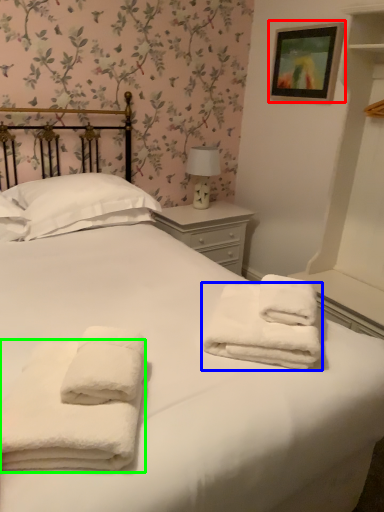
Question: Which object is the farthest from picture frame (highlighted by a red box)? Choose among these: towel (highlighted by a blue box) or towel (highlighted by a green box).

Choices:
 (A) towel
 (B) towel

Answer: (B)